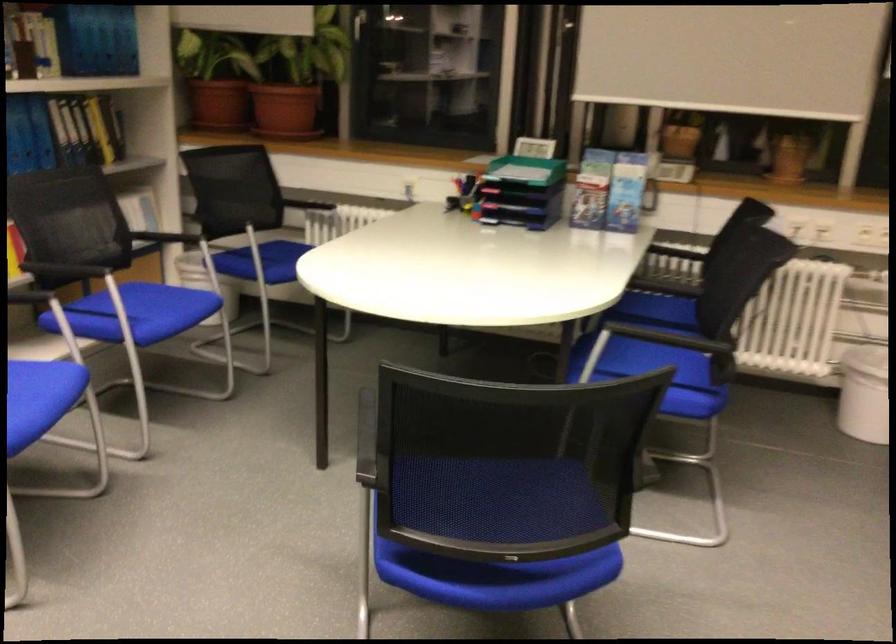
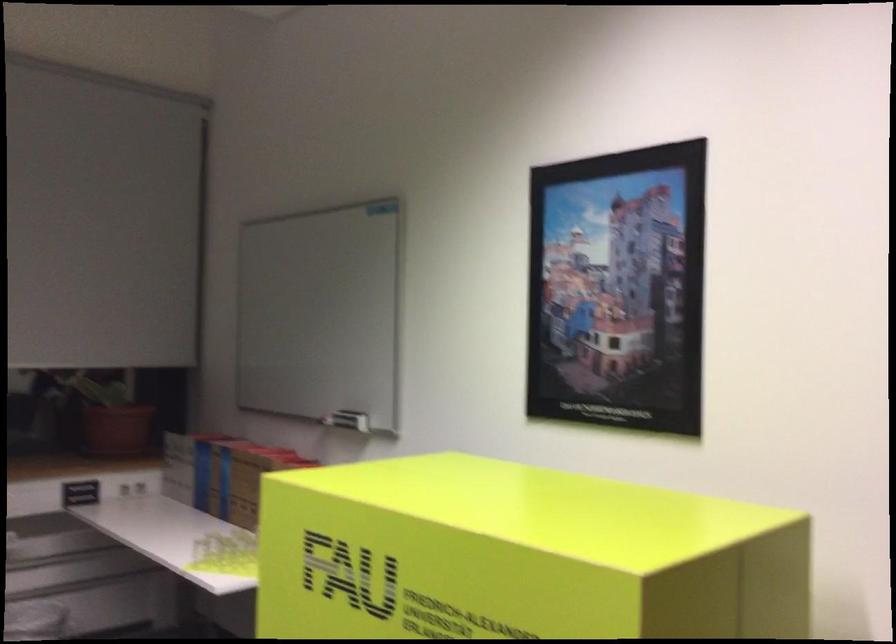
Question: How did the camera likely rotate?

Choices:
 (A) Left
 (B) Right
 (C) Up
 (D) Down

Answer: (B)